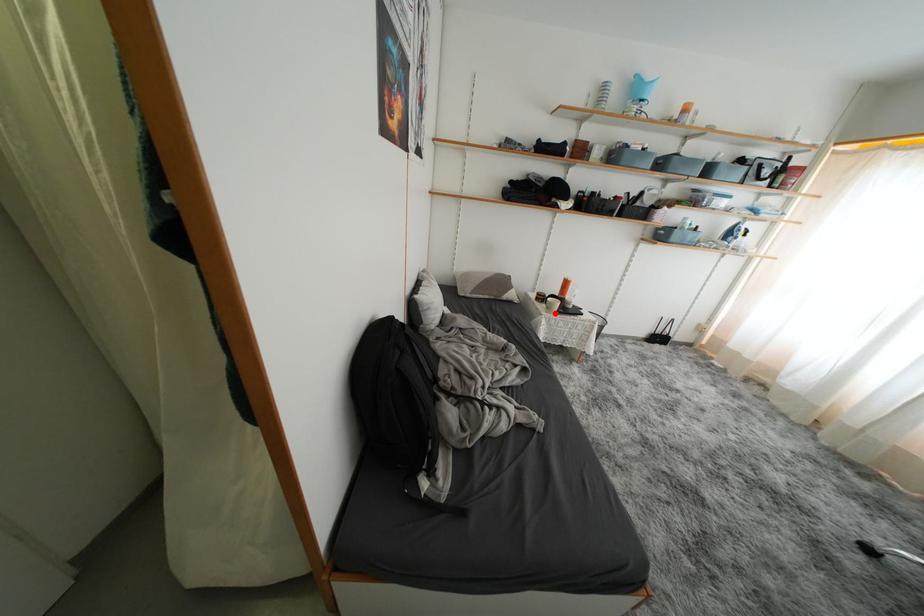
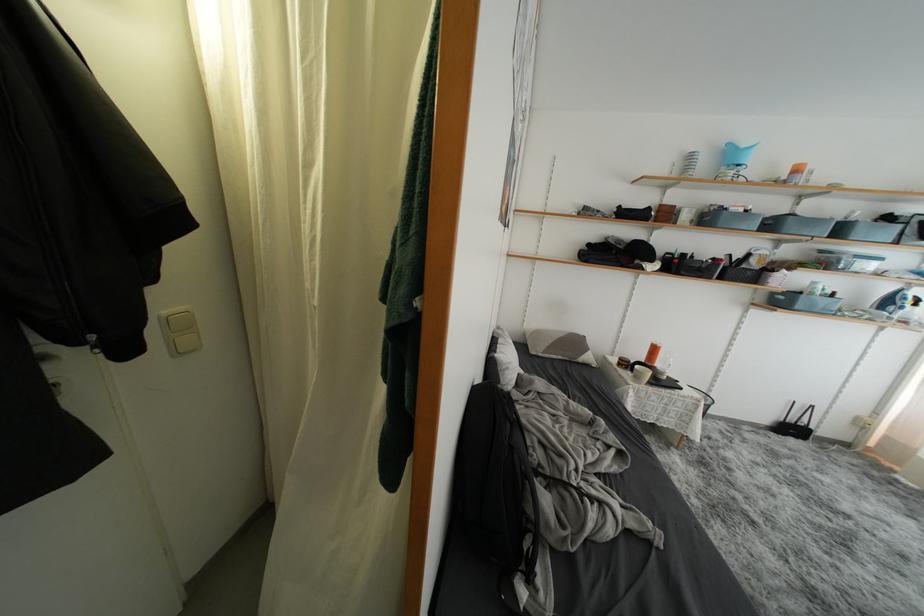
Question: I am providing you with two images of the same scene from different viewpoints. A red point is marked on the first image. At the location where the point appears in image 1, is it still visible in image 2?

Choices:
 (A) Yes
 (B) No

Answer: (A)